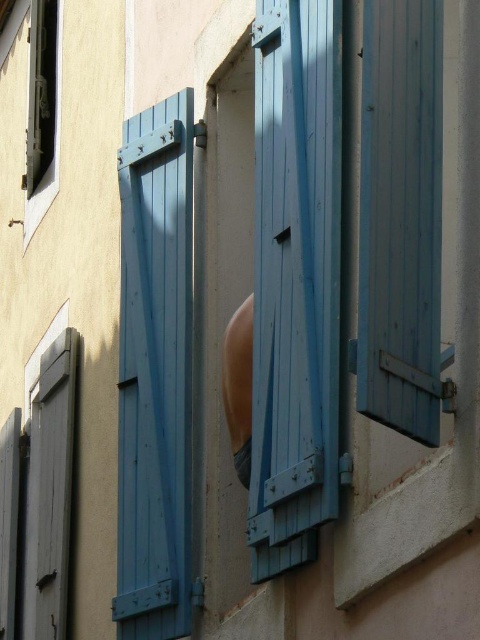
Question: Is blue wooden shutter at center smaller than matte black window at upper left?

Choices:
 (A) yes
 (B) no

Answer: (A)

Question: Considering the real-world distances, which object is closest to the smooth peach skin at center?

Choices:
 (A) matte black window at upper left
 (B) blue wooden shutter at center
 (C) matte blue wooden shutter at left
 (D) blue wooden shutter at right

Answer: (C)

Question: Which of these objects is positioned farthest from the blue wooden shutter at center?

Choices:
 (A) matte blue wooden shutter at left
 (B) blue wooden shutter at right
 (C) matte black window at upper left

Answer: (C)

Question: Which object is the farthest from the matte black window at upper left?

Choices:
 (A) blue wooden shutter at center
 (B) smooth peach skin at center
 (C) matte blue wooden shutter at left

Answer: (A)

Question: Is matte blue wooden shutter at left wider than blue wooden shutter at right?

Choices:
 (A) yes
 (B) no

Answer: (A)

Question: Is blue wooden shutter at right closer to camera compared to matte black window at upper left?

Choices:
 (A) yes
 (B) no

Answer: (A)